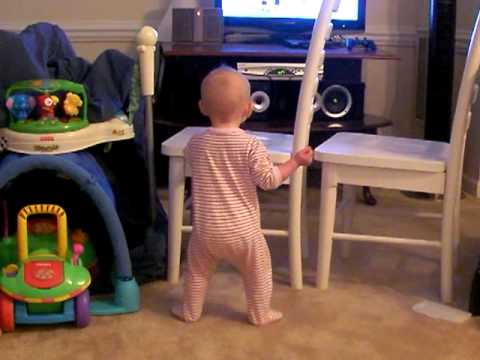
Find the location of a particular element. speaker is located at coordinates (291, 109).